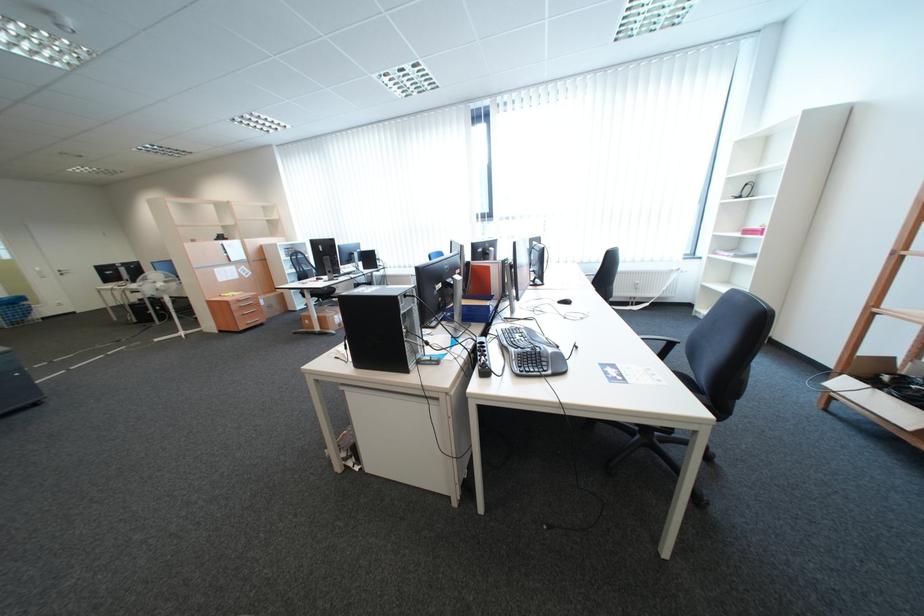
The image size is (924, 616). I want to click on drawer handle, so click(x=246, y=302).